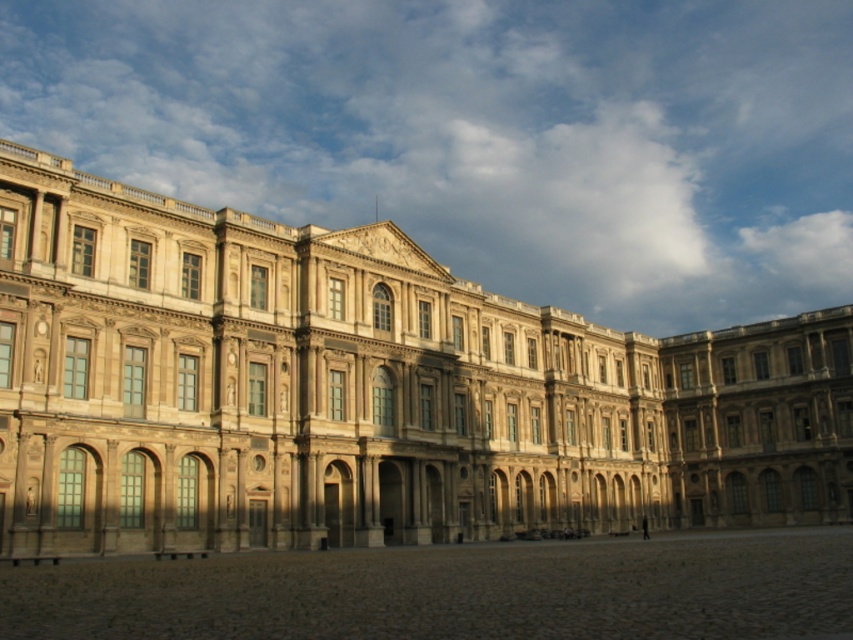
Is beige stone palace at center wider than brown stone courtyard at lower center?

Yes, beige stone palace at center is wider than brown stone courtyard at lower center.

Who is more distant from viewer, (15, 209) or (415, 588)?

Point (15, 209)

Who is more distant from viewer, (x=160, y=525) or (x=419, y=552)?

Positioned behind is point (x=419, y=552).

Locate an element on the screen. The image size is (853, 640). beige stone palace at center is located at coordinates (364, 392).